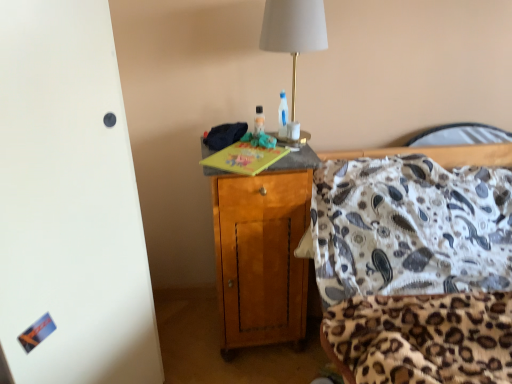
Question: Considering the relative sizes of white fabric lampshade at upper center and wooden cabinet at center in the image provided, is white fabric lampshade at upper center thinner than wooden cabinet at center?

Choices:
 (A) no
 (B) yes

Answer: (B)

Question: From the image's perspective, is white fabric lampshade at upper center on top of wooden cabinet at center?

Choices:
 (A) yes
 (B) no

Answer: (A)

Question: Is white fabric lampshade at upper center aimed at wooden cabinet at center?

Choices:
 (A) yes
 (B) no

Answer: (B)

Question: Is the position of white fabric lampshade at upper center more distant than that of wooden cabinet at center?

Choices:
 (A) yes
 (B) no

Answer: (B)

Question: From a real-world perspective, does white fabric lampshade at upper center sit lower than wooden cabinet at center?

Choices:
 (A) no
 (B) yes

Answer: (A)

Question: Based on their sizes in the image, would you say translucent plastic bottle at center is bigger or smaller than white fabric lampshade at upper center?

Choices:
 (A) big
 (B) small

Answer: (B)

Question: Does point (257, 119) appear closer or farther from the camera than point (311, 21)?

Choices:
 (A) closer
 (B) farther

Answer: (B)

Question: From the image's perspective, is translucent plastic bottle at center located above or below white fabric lampshade at upper center?

Choices:
 (A) below
 (B) above

Answer: (A)

Question: From a real-world perspective, relative to white fabric lampshade at upper center, is translucent plastic bottle at center vertically above or below?

Choices:
 (A) above
 (B) below

Answer: (B)

Question: From the image's perspective, relative to translucent plastic bottle at center, is white fabric lampshade at upper center above or below?

Choices:
 (A) below
 (B) above

Answer: (B)

Question: Relative to translucent plastic bottle at center, is white fabric lampshade at upper center in front or behind?

Choices:
 (A) front
 (B) behind

Answer: (A)

Question: Is white fabric lampshade at upper center wider or thinner than translucent plastic bottle at center?

Choices:
 (A) wide
 (B) thin

Answer: (A)

Question: Is point (308, 24) positioned closer to the camera than point (260, 112)?

Choices:
 (A) farther
 (B) closer

Answer: (B)

Question: Based on their sizes in the image, would you say wooden cabinet at center is bigger or smaller than white fabric lampshade at upper center?

Choices:
 (A) small
 (B) big

Answer: (B)

Question: Visually, is wooden cabinet at center positioned to the left or to the right of white fabric lampshade at upper center?

Choices:
 (A) left
 (B) right

Answer: (A)